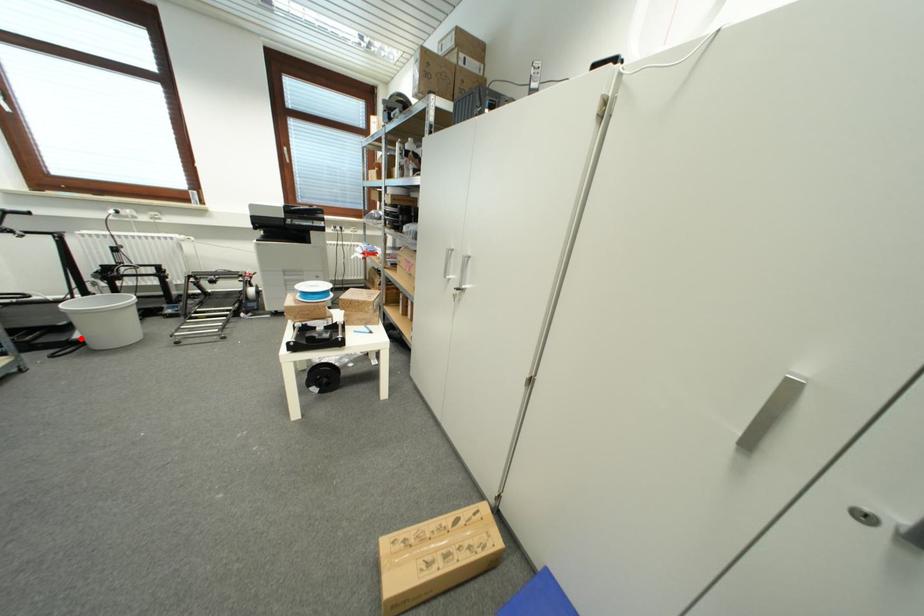
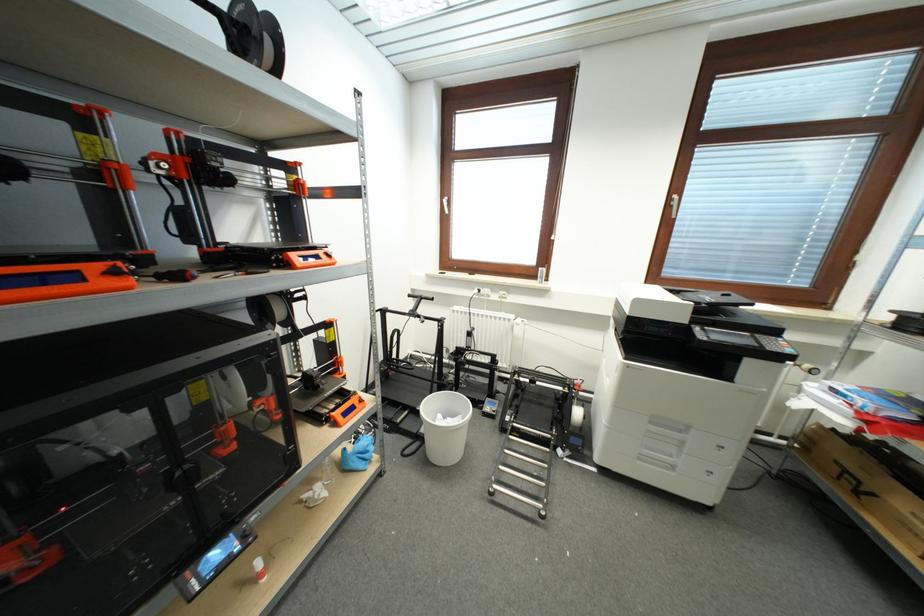
Question: I am providing you with two images of the same scene from different viewpoints. Image1 has a red point marked. In image2, the corresponding 3D location appears at what relative position? Reply with the corresponding letter.

Choices:
 (A) Closer
 (B) Farther

Answer: (B)